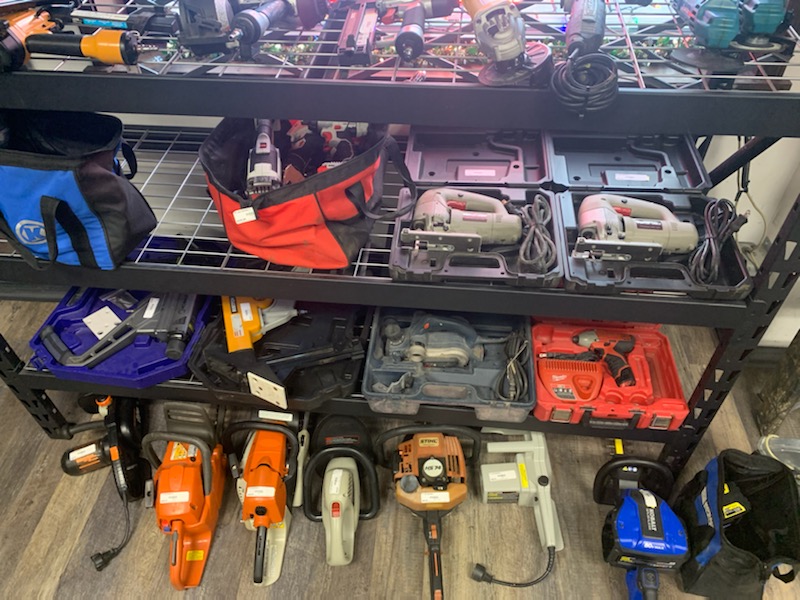
The height and width of the screenshot is (600, 800). I want to click on front of shelfing, so click(x=234, y=92), click(x=304, y=291), click(x=62, y=385).